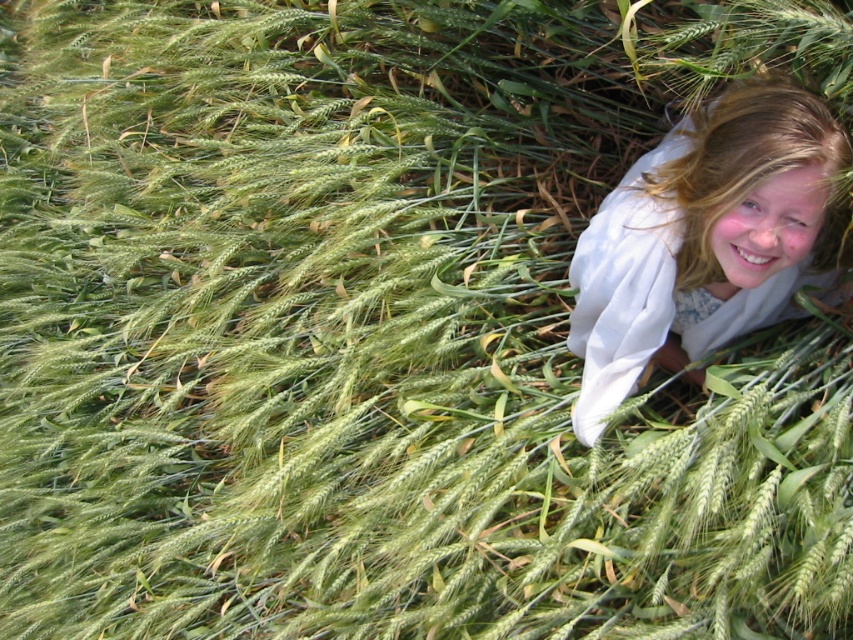
Looking at this image, can you confirm if light brown hair at upper right is positioned below blonde hair at upper right?

Yes, light brown hair at upper right is below blonde hair at upper right.

Which is more to the left, light brown hair at upper right or blonde hair at upper right?

From the viewer's perspective, light brown hair at upper right appears more on the left side.

Who is more distant from viewer, (817, 150) or (733, 157)?

The point (733, 157) is behind.

In order to click on light brown hair at upper right in this screenshot , I will do `click(705, 241)`.